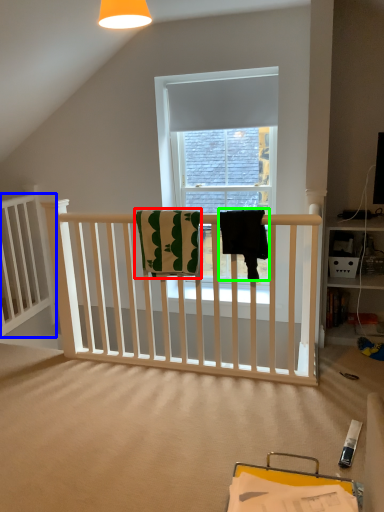
Question: Based on their relative distances, which object is farther from beach towel (highlighted by a red box)? Choose from bed frame (highlighted by a blue box) and beach towel (highlighted by a green box).

Choices:
 (A) bed frame
 (B) beach towel

Answer: (A)